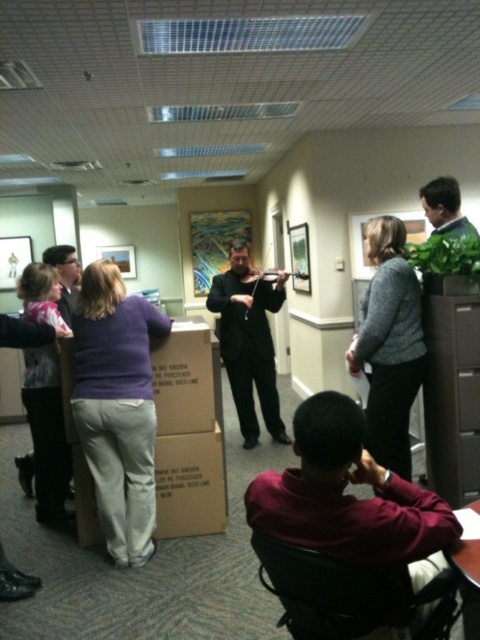
Question: Which object is farther from the camera taking this photo?

Choices:
 (A) purple matte sweater at center
 (B) wooden violin at center
 (C) brown/file cabinet at right

Answer: (B)

Question: Which point is farther to the camera?

Choices:
 (A) brown/file cabinet at right
 (B) purple matte sweater at center
 (C) black matte suit at center

Answer: (C)

Question: Which point is closer to the camera?

Choices:
 (A) (244, 244)
 (B) (254, 282)
 (C) (477, 300)

Answer: (C)

Question: Is the position of gray woolen sweater at center less distant than that of wooden violin at center?

Choices:
 (A) yes
 (B) no

Answer: (A)

Question: Does purple matte sweater at center have a larger size compared to gray woolen sweater at center?

Choices:
 (A) no
 (B) yes

Answer: (B)

Question: Does purple matte sweater at center appear on the left side of brown/file cabinet at right?

Choices:
 (A) yes
 (B) no

Answer: (A)